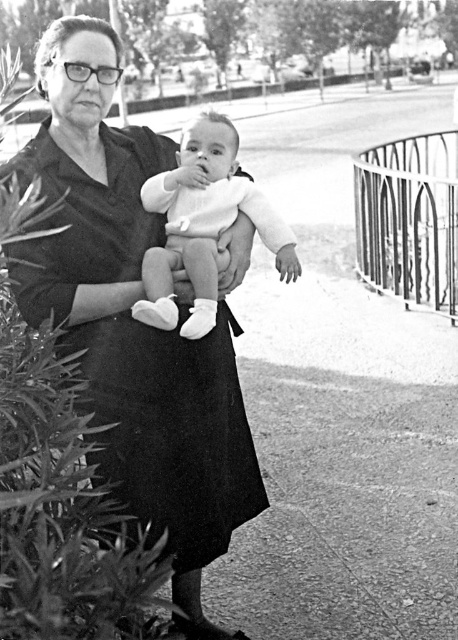
Question: Is black matte dress at center below white soft baby at center?

Choices:
 (A) yes
 (B) no

Answer: (A)

Question: Is black matte dress at center closer to the viewer compared to white soft baby at center?

Choices:
 (A) yes
 (B) no

Answer: (A)

Question: Which point appears farthest from the camera in this image?

Choices:
 (A) (172, 141)
 (B) (186, 257)

Answer: (A)

Question: Does black matte dress at center appear under white soft baby at center?

Choices:
 (A) no
 (B) yes

Answer: (B)

Question: Which of the following is the farthest from the observer?

Choices:
 (A) (130, 460)
 (B) (212, 248)

Answer: (B)